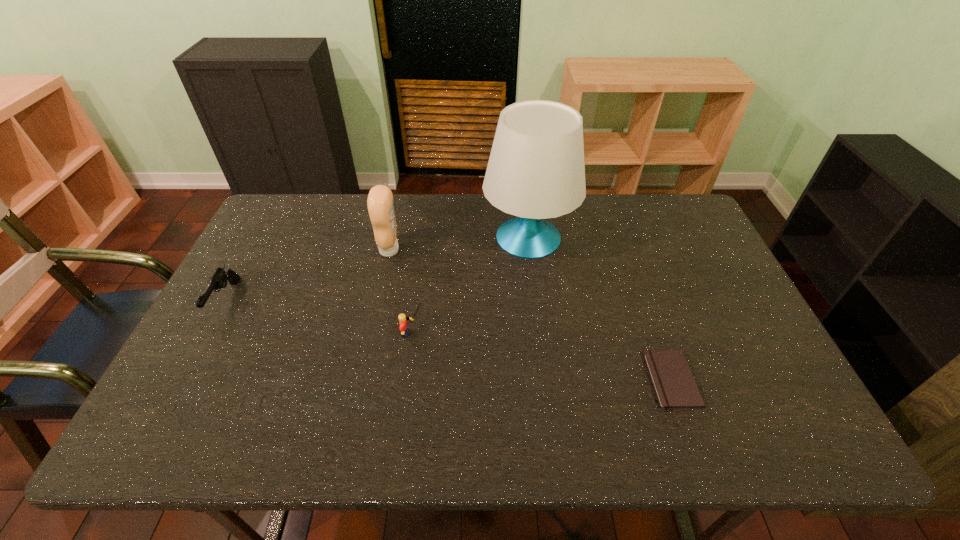
Identify the location of empty space between the nearest object and the tallest object. (600, 309).

Find the location of a particular element. The height and width of the screenshot is (540, 960). empty space between the gun and the second nearest object is located at coordinates (320, 316).

Identify the location of vacant point located between the table lamp and the fourth farthest object. (470, 285).

Locate which object ranks fourth in proximity to the Lego. Please provide its 2D coordinates. Your answer should be formatted as a tuple, i.e. [(x, y)], where the tuple contains the x and y coordinates of a point satisfying the conditions above.

[(675, 387)]

Identify which object is the nearest to the leftmost object. Please provide its 2D coordinates. Your answer should be formatted as a tuple, i.e. [(x, y)], where the tuple contains the x and y coordinates of a point satisfying the conditions above.

[(380, 204)]

This screenshot has height=540, width=960. Find the location of `free spot that satisfies the following two spatial constraints: 1. at the end of the barrel of the gun; 2. on the right side of the nearest object`. free spot that satisfies the following two spatial constraints: 1. at the end of the barrel of the gun; 2. on the right side of the nearest object is located at coordinates (182, 380).

The image size is (960, 540). Find the location of `vacant space that satisfies the following two spatial constraints: 1. on the front-facing side of the rightmost object; 2. on the right side of the table lamp`. vacant space that satisfies the following two spatial constraints: 1. on the front-facing side of the rightmost object; 2. on the right side of the table lamp is located at coordinates (546, 380).

At what (x,y) coordinates should I click in order to perform the action: click on vacant space that satisfies the following two spatial constraints: 1. on the front-facing side of the fourth farthest object; 2. on the back side of the nearest object. Please return your answer as a coordinate pair (x, y). The width and height of the screenshot is (960, 540). Looking at the image, I should click on (406, 380).